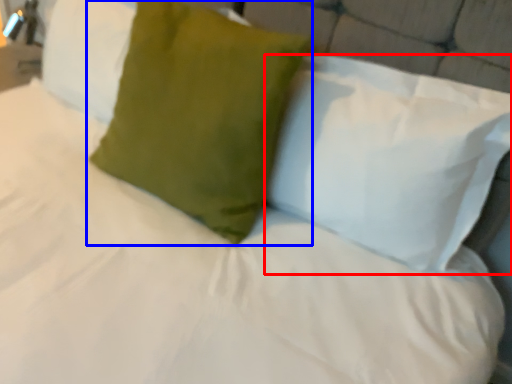
Question: Which object is further to the camera taking this photo, pillow (highlighted by a red box) or pillow (highlighted by a blue box)?

Choices:
 (A) pillow
 (B) pillow

Answer: (B)